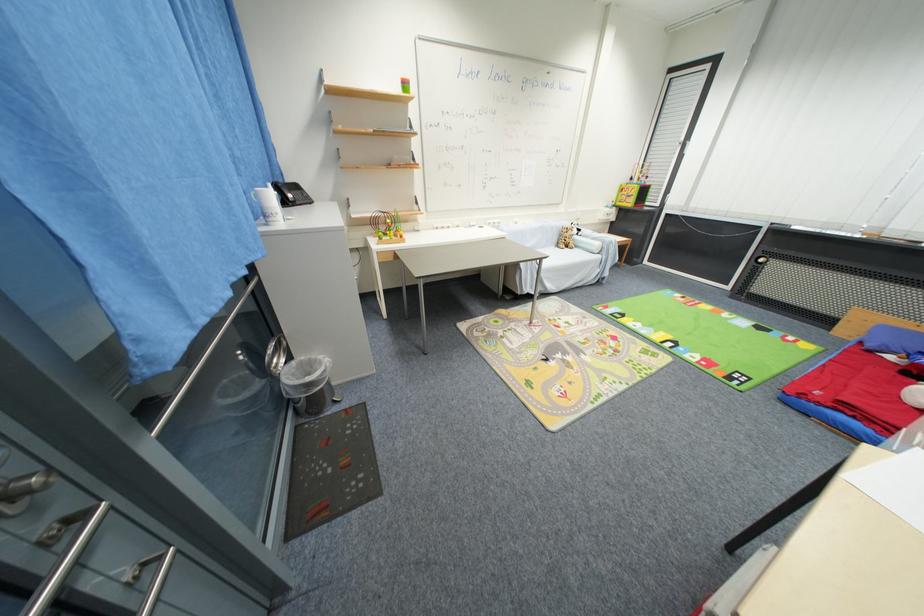
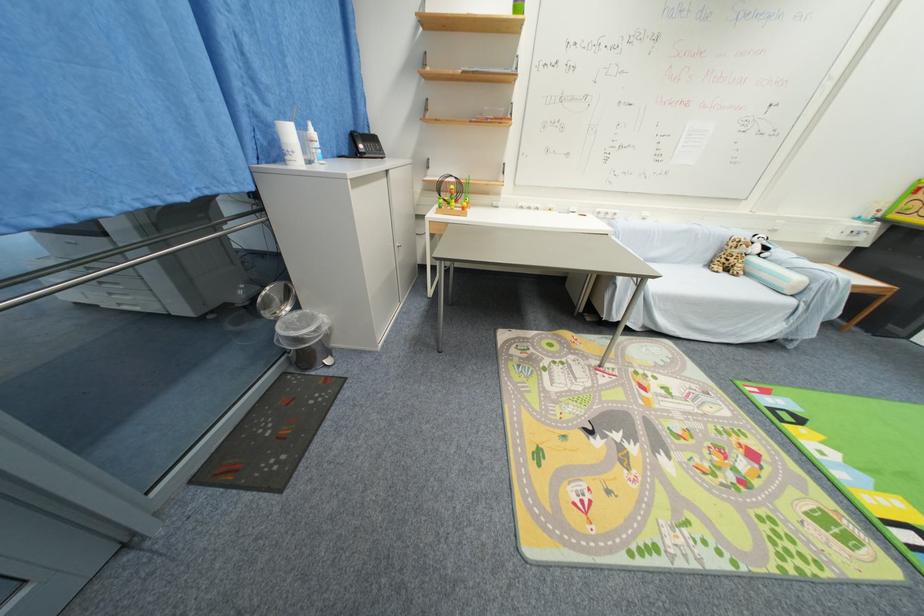
Find the pixel in the second image that matches (x=572, y=251) in the first image.

(730, 276)